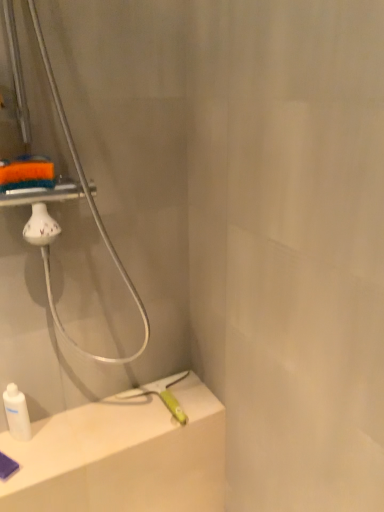
Identify the location of vacant region to the right of white glossy bottle at lower left. Image resolution: width=384 pixels, height=512 pixels. (72, 435).